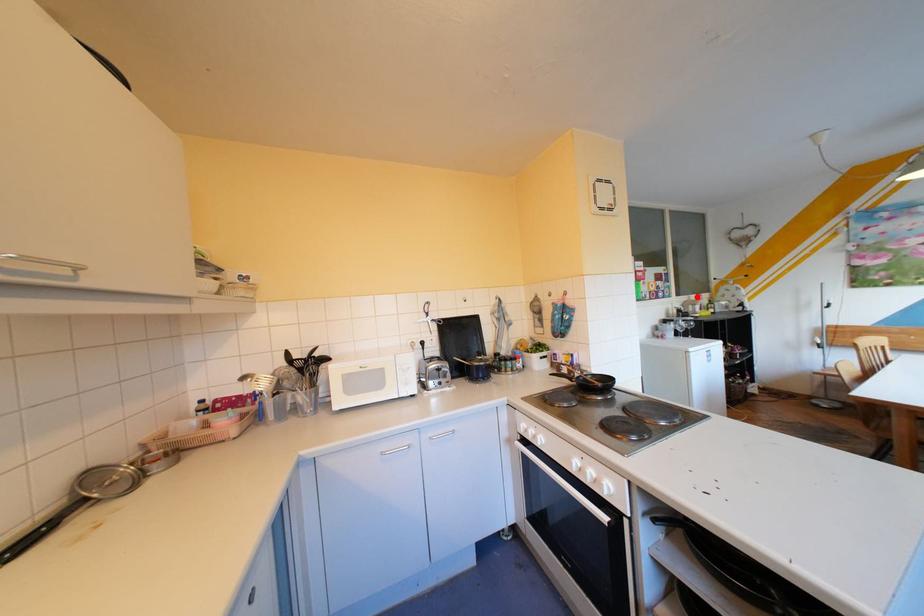
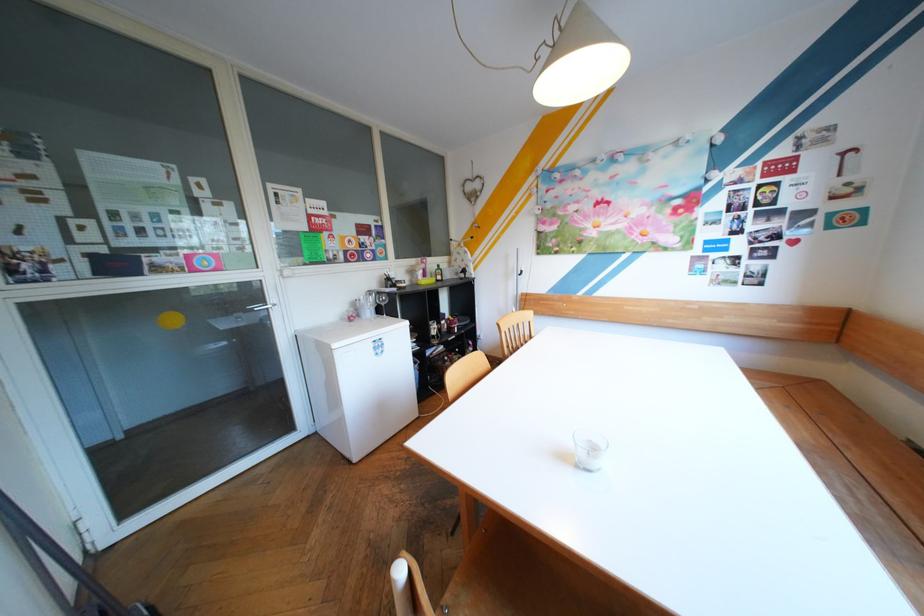
In the second image, find the point that corresponds to the highlighted location in the first image.

(426, 261)